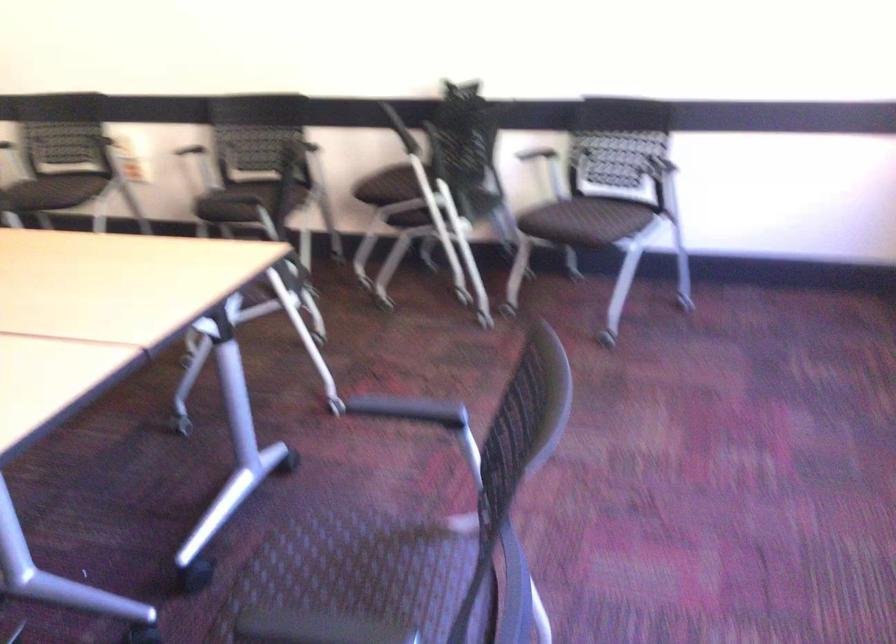
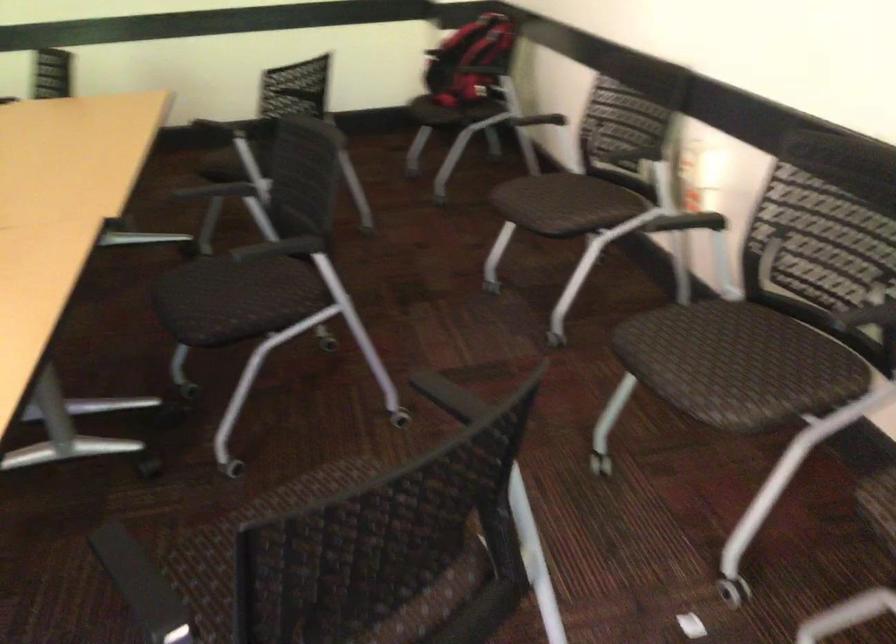
The point at (83, 180) is marked in the first image. Where is the corresponding point in the second image?

(581, 207)